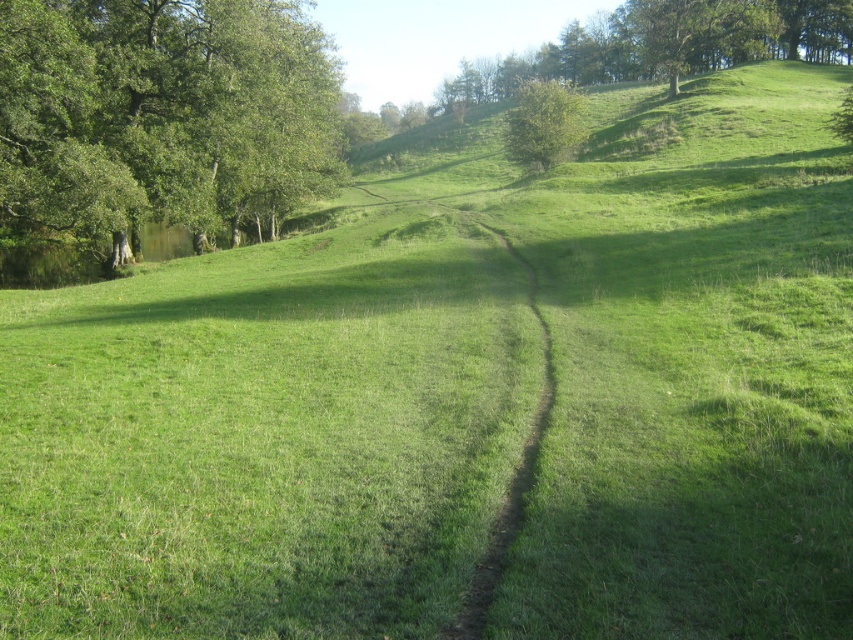
You are a hiker standing on the dirt path in the foreground of the image. You see the green leafy tree at left and the green leafy tree at upper center. Which tree is positioned lower in the scene?

The green leafy tree at left is positioned lower in the scene than the green leafy tree at upper center.

You are planning to set up a picnic area in the grassy field. Considering the green leafy tree at left and the green leafy tree at upper center, which tree would provide more shade coverage for your picnic blanket?

The green leafy tree at upper center would provide more shade coverage because it is thicker than the green leafy tree at left.